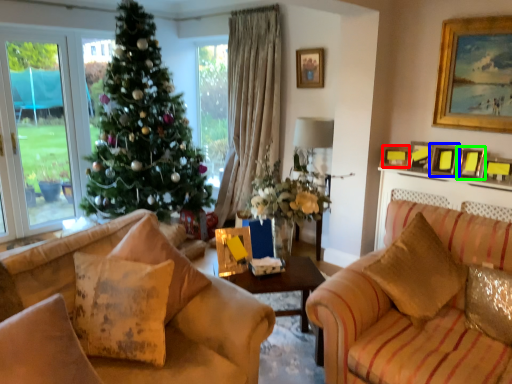
Question: Which object is the closest to the picture frame (highlighted by a red box)? Choose among these: picture frame (highlighted by a blue box) or picture frame (highlighted by a green box).

Choices:
 (A) picture frame
 (B) picture frame

Answer: (A)